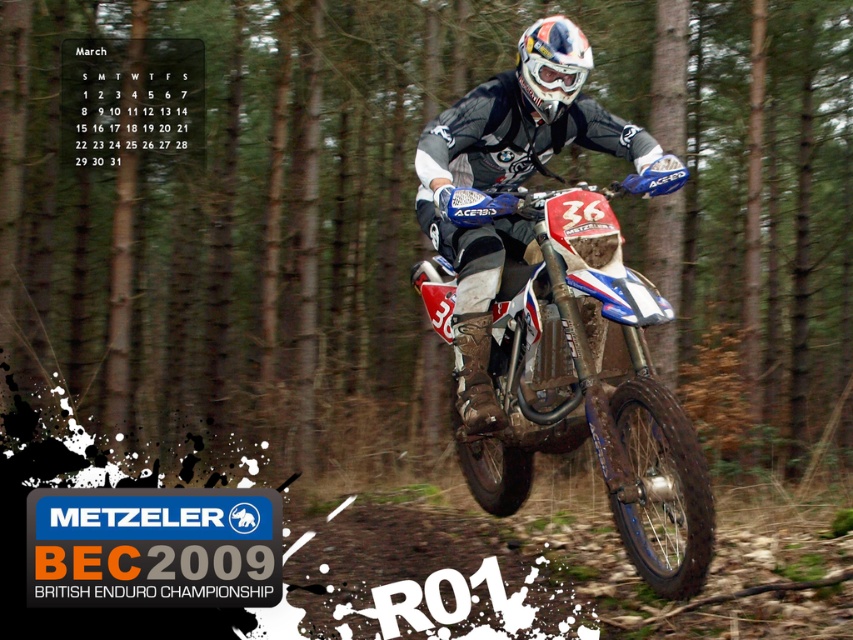
Can you confirm if white glossy motorbike at center is positioned below white matte helmet at center?

Correct, white glossy motorbike at center is located below white matte helmet at center.

Is point (535, 273) behind point (556, 112)?

No, it is in front of (556, 112).

Does point (492, 442) lie in front of point (524, 99)?

No, it is not.

The image size is (853, 640). I want to click on white glossy motorbike at center, so click(590, 387).

Can you confirm if white glossy motorbike at center is smaller than white matte helmet at upper center?

No.

Does white glossy motorbike at center appear over white matte helmet at upper center?

Incorrect, white glossy motorbike at center is not positioned above white matte helmet at upper center.

What do you see at coordinates (590, 387) in the screenshot? This screenshot has width=853, height=640. I see `white glossy motorbike at center` at bounding box center [590, 387].

Identify the location of white glossy motorbike at center. The width and height of the screenshot is (853, 640). (590, 387).

From the picture: Does white matte helmet at upper center appear on the left side of white matte helmet at center?

Yes, white matte helmet at upper center is to the left of white matte helmet at center.

Image resolution: width=853 pixels, height=640 pixels. I want to click on white matte helmet at upper center, so click(515, 180).

Find the location of `white matte helmet at upper center`. white matte helmet at upper center is located at coordinates (515, 180).

Locate an element on the screen. This screenshot has height=640, width=853. white matte helmet at upper center is located at coordinates (515, 180).